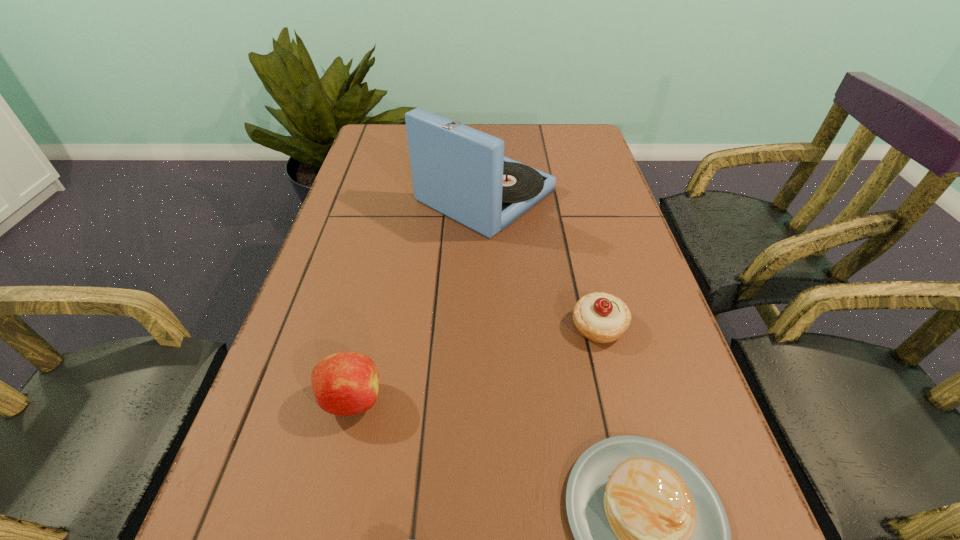
Where is `object at the right edge`? object at the right edge is located at coordinates (600, 317).

This screenshot has width=960, height=540. I want to click on vacant region at the far edge of the desktop, so click(514, 130).

Identify the location of vacant space at the left edge of the desktop. The image size is (960, 540). (385, 248).

The height and width of the screenshot is (540, 960). In order to click on vacant space at the right edge of the desktop in this screenshot , I will do `click(624, 341)`.

Locate an element on the screen. vacant area at the far left corner is located at coordinates [395, 131].

In the image, there is a desktop. At what (x,y) coordinates should I click in order to perform the action: click on vacant area at the far right corner. Please return your answer as a coordinate pair (x, y). Looking at the image, I should click on (585, 138).

You are a GUI agent. You are given a task and a screenshot of the screen. Output one action in this format:
    pyautogui.click(x=<x>, y=<y>)
    Task: Click on the empty space that is in between the third nearest object and the tallest object
    Image resolution: width=960 pixels, height=540 pixels.
    Given the screenshot: What is the action you would take?
    pyautogui.click(x=542, y=261)

At what (x,y) coordinates should I click in order to perform the action: click on free spot between the third farthest object and the second shortest object. Please return your answer as a coordinate pair (x, y). Looking at the image, I should click on (475, 363).

Where is `free area in between the pastry and the tallest object`? Image resolution: width=960 pixels, height=540 pixels. free area in between the pastry and the tallest object is located at coordinates (542, 261).

Point out which object is positioned as the second nearest to the pastry. Please provide its 2D coordinates. Your answer should be formatted as a tuple, i.e. [(x, y)], where the tuple contains the x and y coordinates of a point satisfying the conditions above.

[(460, 172)]